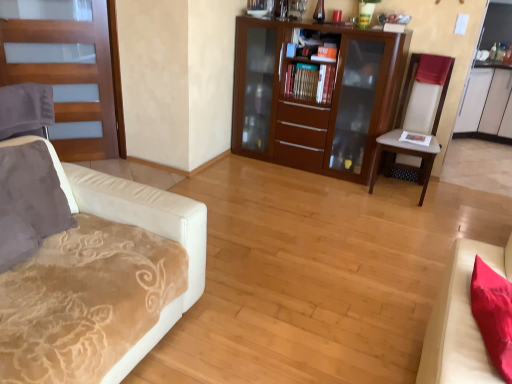
Find the location of a particular element. This screenshot has height=384, width=512. blank area beneath beige fabric chair at right (from a real-world perspective) is located at coordinates (402, 187).